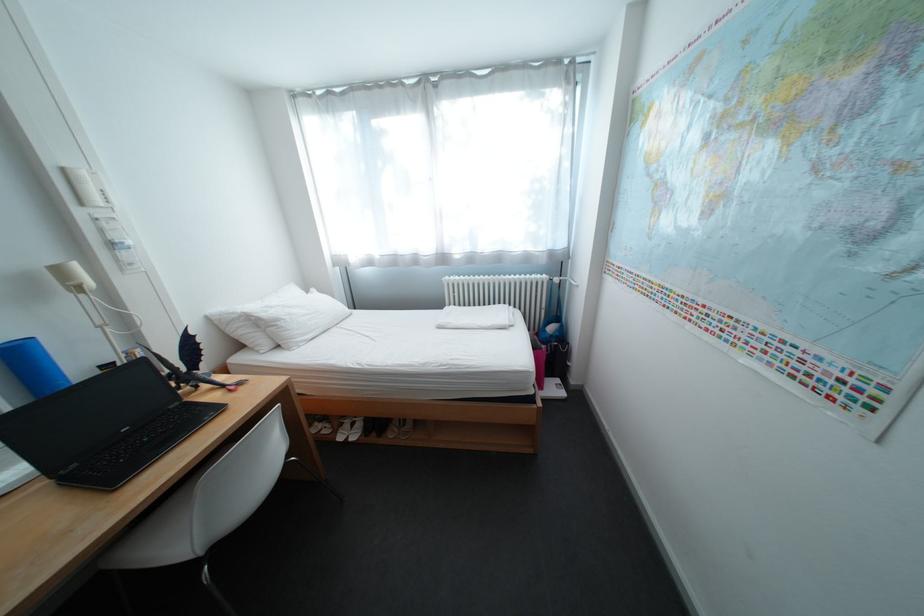
Find the location of a particular element. This screenshot has height=616, width=924. white chair sitting surface is located at coordinates (157, 533).